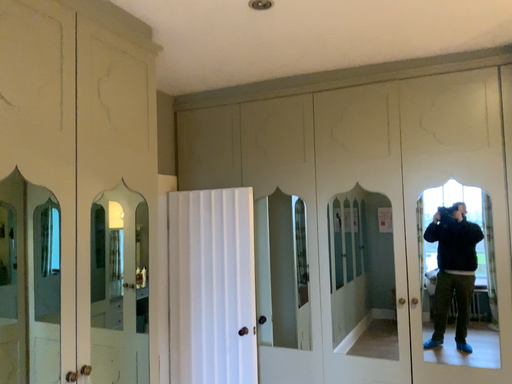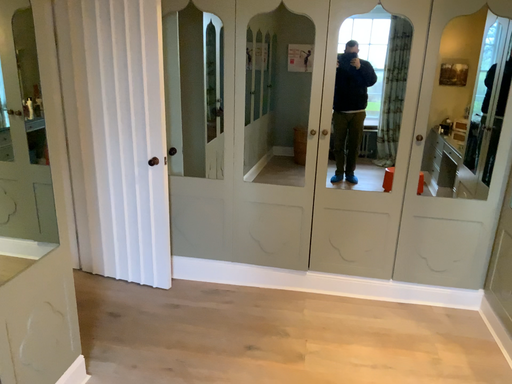
Question: Which way did the camera rotate in the video?

Choices:
 (A) rotated upward
 (B) rotated downward

Answer: (B)